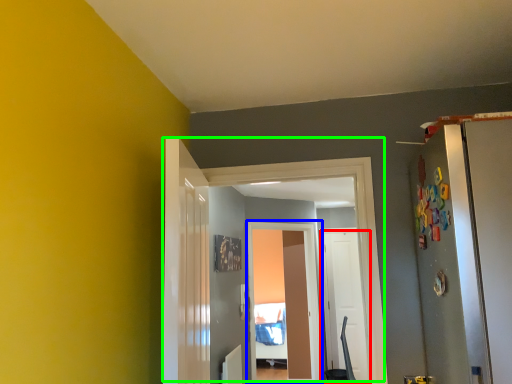
Question: Estimate the real-world distances between objects in this image. Which object is closer to door (highlighted by a red box), screen door (highlighted by a blue box) or door (highlighted by a green box)?

Choices:
 (A) screen door
 (B) door

Answer: (A)